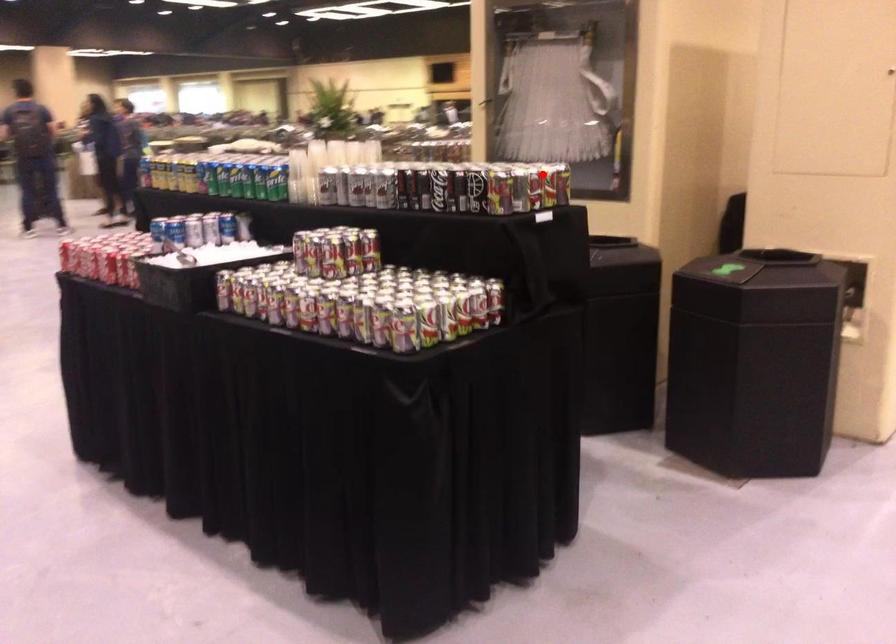
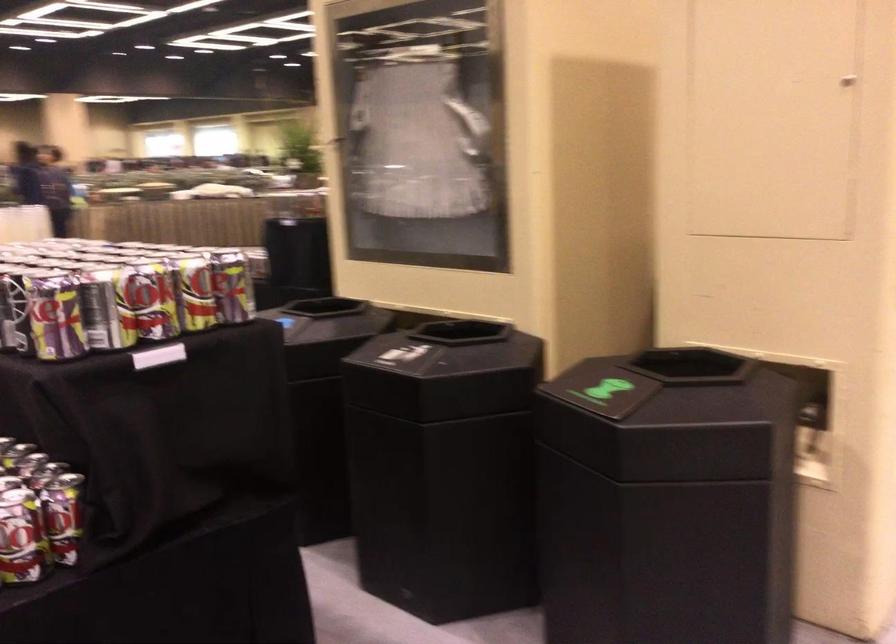
In the second image, find the point that corresponds to the highlighted location in the first image.

(161, 299)